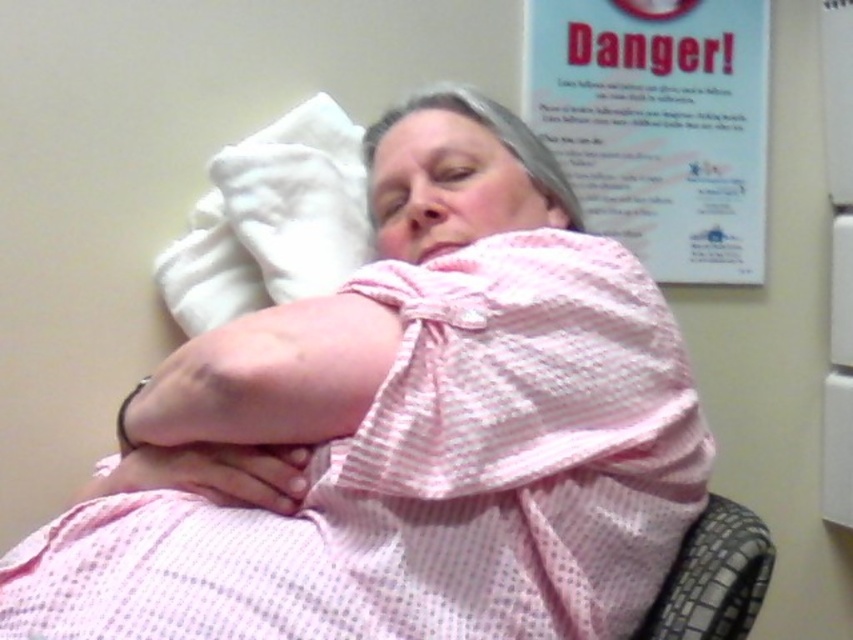
Question: Is pink gingham hospital gown at center thinner than black mesh chair at lower right?

Choices:
 (A) yes
 (B) no

Answer: (B)

Question: Which object appears closest to the camera in this image?

Choices:
 (A) white soft pillow at upper left
 (B) pink gingham hospital gown at center

Answer: (B)

Question: Considering the real-world distances, which object is farthest from the white soft pillow at upper left?

Choices:
 (A) pink gingham hospital gown at center
 (B) black mesh chair at lower right
 (C) white paper at upper right

Answer: (B)

Question: Does pink gingham hospital gown at center lie behind black mesh chair at lower right?

Choices:
 (A) yes
 (B) no

Answer: (B)

Question: Does white paper at upper right appear on the left side of black mesh chair at lower right?

Choices:
 (A) no
 (B) yes

Answer: (A)

Question: Which of these objects is positioned farthest from the pink gingham hospital gown at center?

Choices:
 (A) white paper at upper right
 (B) black mesh chair at lower right
 (C) white soft pillow at upper left

Answer: (A)